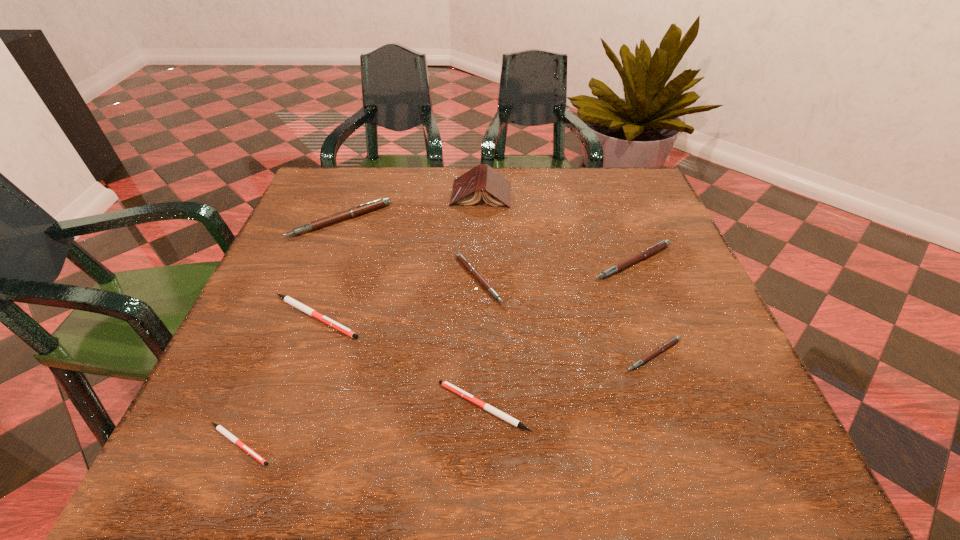
Locate an element on the screen. The width and height of the screenshot is (960, 540). vacant space at the far left corner is located at coordinates (337, 188).

Identify the location of vacant space at the far right corner of the desktop. (604, 180).

This screenshot has height=540, width=960. I want to click on free area in between the book and the biggest white pen, so 398,255.

Locate an element on the screen. Image resolution: width=960 pixels, height=540 pixels. blank region between the shortest object and the farthest pen is located at coordinates (290, 332).

Where is `free area in between the farthest white pen and the third pink pen from right to left`? Image resolution: width=960 pixels, height=540 pixels. free area in between the farthest white pen and the third pink pen from right to left is located at coordinates (396, 298).

Find the location of a particular element. The image size is (960, 540). empty space between the smallest white pen and the rightmost white pen is located at coordinates (361, 425).

The image size is (960, 540). What are the coordinates of `free space between the farthest pink pen and the second smallest pink pen` in the screenshot? It's located at (409, 250).

Find the location of a particular element. The image size is (960, 540). vacant space that's between the biggest white pen and the third smallest pink pen is located at coordinates (474, 289).

The image size is (960, 540). What are the coordinates of `vacant space in between the second tallest pen and the brown book` in the screenshot? It's located at (557, 228).

At what (x,y) coordinates should I click in order to perform the action: click on vacant point located between the shortest pen and the tallest pen. Please return your answer as a coordinate pair (x, y). The image size is (960, 540). Looking at the image, I should click on (290, 332).